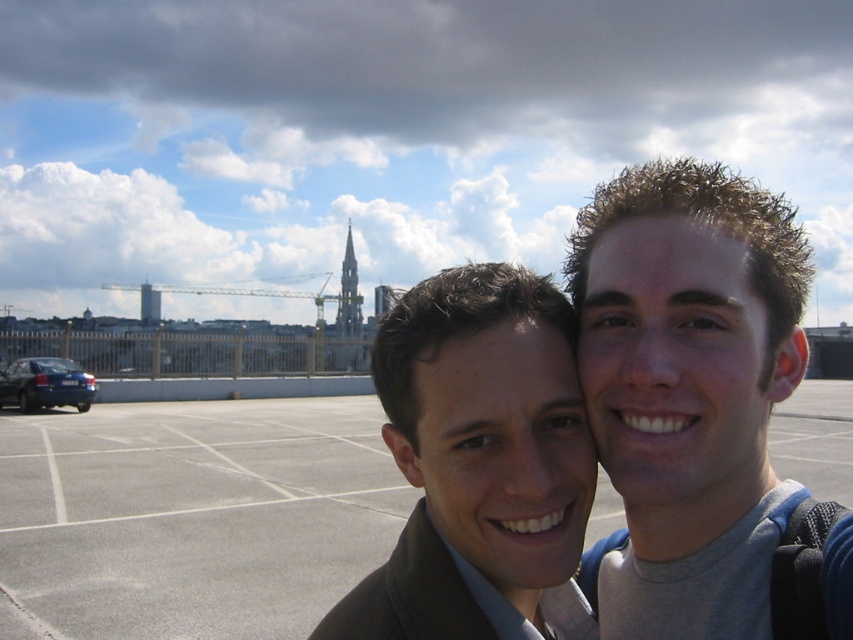
You are standing in the middle of the gray concrete parking lot at center and want to walk towards the matte black jacket at center. Which direction should you head?

The gray concrete parking lot at center is to the right of the matte black jacket at center, so you should head to the left to reach it.

You are standing at the origin point of the coordinate system in the image. The gray concrete parking lot at center is located at point 0.808, 0.225. If you want to move towards the parking lot, which direction should you move in terms of the x and y axes?

To move towards the gray concrete parking lot at center located at coordinates (190, 516) from the origin, you should move in the positive x and positive y direction since both coordinates are greater than zero.

In the scene shown: You are a photographer trying to capture both jackets in a single shot. Since both jackets are at the center, will the matte black jacket at center be visible behind the matte brown jacket at center?

The matte black jacket at center is behind the matte brown jacket at center, so it may be partially or fully obscured depending on their positions. Adjust your angle or have the matte brown jacket at center move slightly to ensure both are visible.